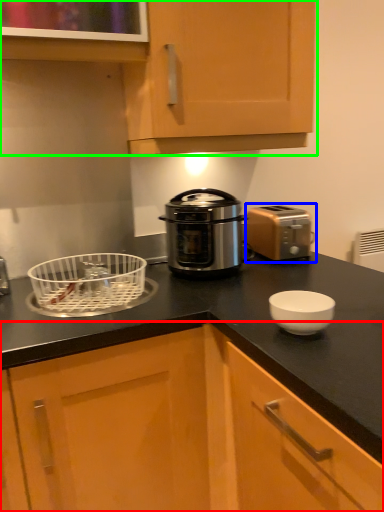
Question: Considering the real-world distances, which object is farthest from cabinetry (highlighted by a red box)? toaster (highlighted by a blue box) or cabinetry (highlighted by a green box)?

Choices:
 (A) toaster
 (B) cabinetry

Answer: (B)